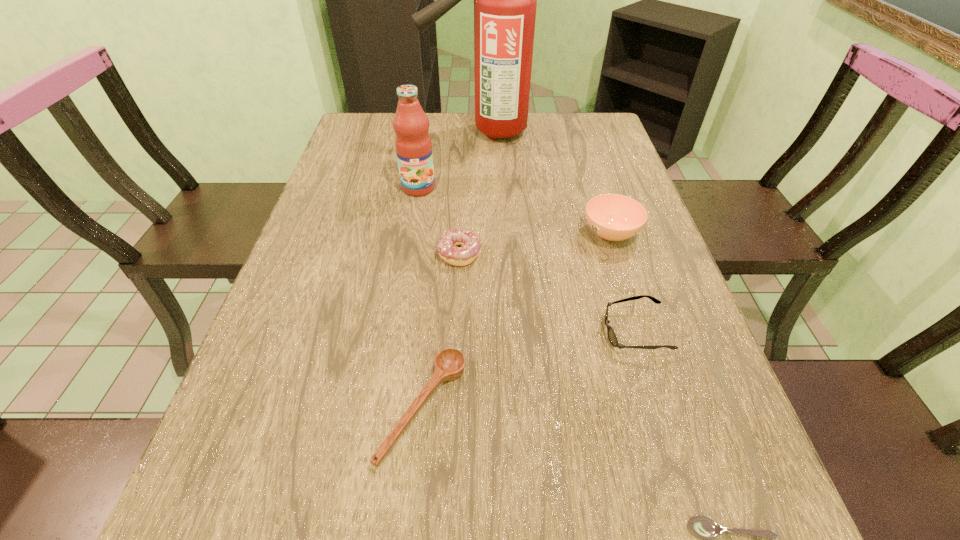
At what (x,y) coordinates should I click in order to perform the action: click on free point located 0.160m at the nozzle of the farthest object. Please return your answer as a coordinate pair (x, y). Looking at the image, I should click on (373, 132).

Identify the location of vacant area situated 0.230m on the front label of the sixth shortest object. The width and height of the screenshot is (960, 540). (407, 257).

Image resolution: width=960 pixels, height=540 pixels. Find the location of `vacant space located 0.360m on the left of the soup bowl`. vacant space located 0.360m on the left of the soup bowl is located at coordinates (434, 233).

You are a GUI agent. You are given a task and a screenshot of the screen. Output one action in this format:
    pyautogui.click(x=<x>, y=<y>)
    Task: Click on the free point located on the back of the doughnut
    
    Given the screenshot: What is the action you would take?
    pyautogui.click(x=463, y=186)

Where is `free space located 0.200m on the lenses of the sunglasses`? The height and width of the screenshot is (540, 960). free space located 0.200m on the lenses of the sunglasses is located at coordinates (502, 332).

Where is `vacant space located 0.060m on the lenses of the sunglasses`? vacant space located 0.060m on the lenses of the sunglasses is located at coordinates point(573,332).

The height and width of the screenshot is (540, 960). What are the coordinates of `free space located 0.310m on the lenses of the sunglasses` in the screenshot? It's located at (446, 332).

Identify the location of vacant region located on the back of the wooden spoon. This screenshot has height=540, width=960. (441, 227).

Find the location of a particular element. object that is at the far edge is located at coordinates tap(505, 0).

The width and height of the screenshot is (960, 540). What are the coordinates of `soup bowl located in the right edge section of the desktop` in the screenshot? It's located at (613, 217).